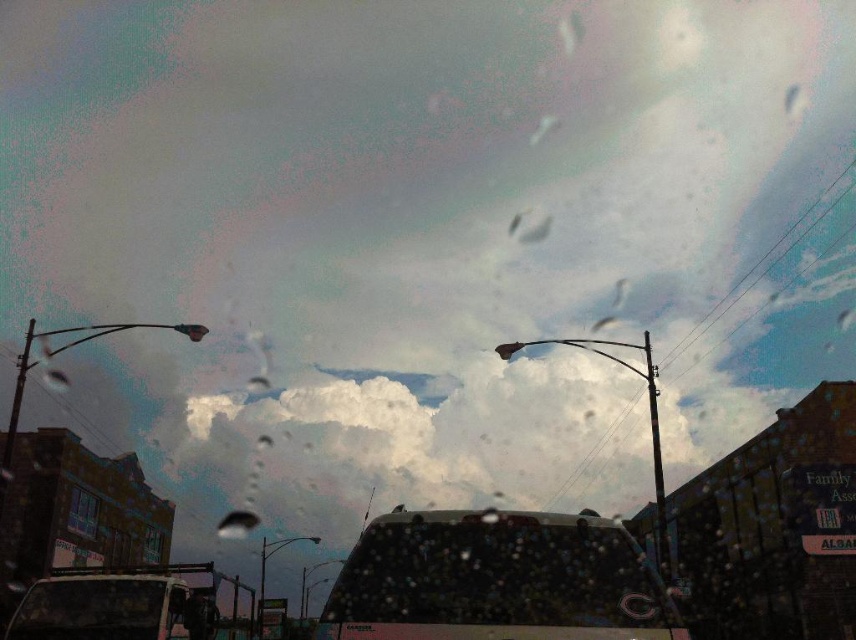
You are sitting in the driver seat of the vehicle and notice two points on the windshield. The first point is at coordinates point (412,612) and the second is at point (183,627). Which point is closer to you?

Point (412,612) is closer to the viewer than point (183,627).

You are a passenger in the vehicle. You notice a point on the windshield at coordinate (497, 579). Is this point closer to the center of the windshield or the edge?

The point at coordinate (497, 579) is closer to the edge of the windshield than the center.

You are a pedestrian standing on the sidewalk. You see a dark matte car at center approaching you. Can you safely cross the road before it reaches you if you start walking now?

The dark matte car at center is 3.64 meters away from you. If you start walking now, you have enough time to cross the road safely before it reaches you, assuming it maintains its current speed or stops.